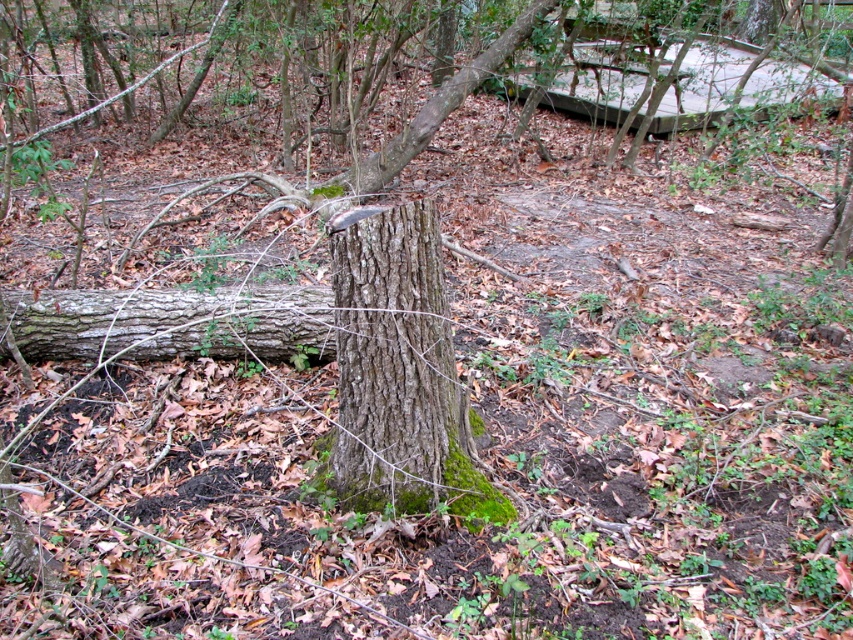
Between point (343, 388) and point (198, 340), which one is positioned behind?

Positioned behind is point (198, 340).

Is green mossy bark at center smaller than brown rough log at center?

No, green mossy bark at center is not smaller than brown rough log at center.

Measure the distance between point (390, 236) and camera.

They are 6.96 feet apart.

The height and width of the screenshot is (640, 853). I want to click on green mossy bark at center, so click(396, 369).